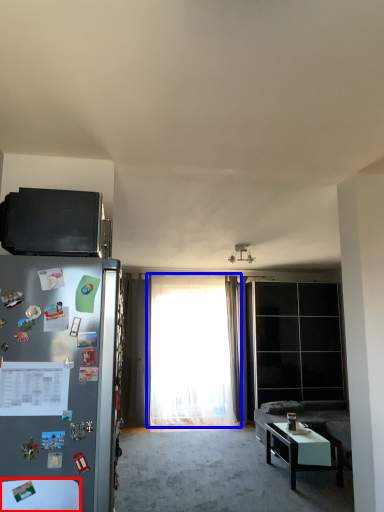
Question: Which object appears closest to the camera in this image, table (highlighted by a red box) or curtain (highlighted by a blue box)?

Choices:
 (A) table
 (B) curtain

Answer: (A)